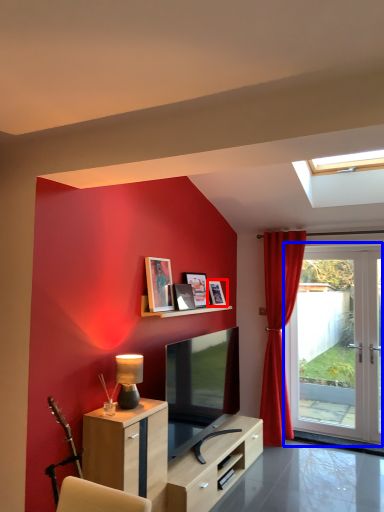
Question: Which object is further to the camera taking this photo, picture frame (highlighted by a red box) or door (highlighted by a blue box)?

Choices:
 (A) picture frame
 (B) door

Answer: (B)